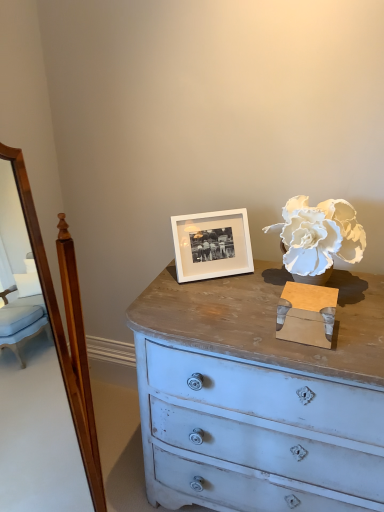
The image size is (384, 512). What do you see at coordinates (318, 237) in the screenshot?
I see `white paper flower at upper right` at bounding box center [318, 237].

This screenshot has width=384, height=512. In order to click on white paper flower at upper right in this screenshot , I will do `click(318, 237)`.

The width and height of the screenshot is (384, 512). What do you see at coordinates (212, 245) in the screenshot?
I see `white matte picture frame at center` at bounding box center [212, 245].

This screenshot has width=384, height=512. I want to click on white matte picture frame at center, so click(x=212, y=245).

Identify the location of white paper flower at upper right. (318, 237).

In the scene shown: Is white matte picture frame at center to the left of white paper flower at upper right from the viewer's perspective?

Yes, white matte picture frame at center is to the left of white paper flower at upper right.

Which is in front, white matte picture frame at center or white paper flower at upper right?

white paper flower at upper right is in front.

Which is nearer, (245, 265) or (309, 244)?

Clearly, point (245, 265) is more distant from the camera than point (309, 244).

From the image's perspective, does white matte picture frame at center appear higher than white paper flower at upper right?

No.

In the scene shown: From a real-world perspective, is white matte picture frame at center positioned over white paper flower at upper right based on gravity?

No, from a real-world perspective, white matte picture frame at center is not over white paper flower at upper right

Considering the sizes of objects white matte picture frame at center and white paper flower at upper right in the image provided, who is wider, white matte picture frame at center or white paper flower at upper right?

With larger width is white paper flower at upper right.

In terms of height, does white matte picture frame at center look taller or shorter compared to white paper flower at upper right?

In the image, white matte picture frame at center appears to be shorter than white paper flower at upper right.

Is white matte picture frame at center bigger than white paper flower at upper right?

No.

Is white matte picture frame at center not inside white paper flower at upper right?

Absolutely, white matte picture frame at center is external to white paper flower at upper right.

Is white matte picture frame at center in contact with white paper flower at upper right?

No, white matte picture frame at center is not next to white paper flower at upper right.

Could you tell me if white matte picture frame at center is turned towards white paper flower at upper right?

No, white matte picture frame at center is not aimed at white paper flower at upper right.

How different are the orientations of white matte picture frame at center and white paper flower at upper right in degrees?

The angular difference between white matte picture frame at center and white paper flower at upper right is 38.6 degrees.

Measure the distance from white matte picture frame at center to white paper flower at upper right.

white matte picture frame at center is 10.79 inches from white paper flower at upper right.

Locate an element on the screen. This screenshot has width=384, height=512. flower on the right of white matte picture frame at center is located at coordinates (318, 237).

Between white paper flower at upper right and white matte picture frame at center, which one appears on the right side from the viewer's perspective?

From the viewer's perspective, white paper flower at upper right appears more on the right side.

Considering the relative positions of white paper flower at upper right and white matte picture frame at center in the image provided, is white paper flower at upper right behind white matte picture frame at center?

That is False.

Which point is more distant from viewer, (332, 259) or (207, 274)?

The point (207, 274) is more distant.

From the image's perspective, who appears lower, white paper flower at upper right or white matte picture frame at center?

A: white matte picture frame at center, from the image's perspective.

Consider the image. From a real-world perspective, does white paper flower at upper right sit lower than white matte picture frame at center?

Incorrect, from a real-world perspective, white paper flower at upper right is higher than white matte picture frame at center.

Is white paper flower at upper right wider or thinner than white matte picture frame at center?

white paper flower at upper right is wider than white matte picture frame at center.

Who is shorter, white paper flower at upper right or white matte picture frame at center?

white matte picture frame at center.

Who is smaller, white paper flower at upper right or white matte picture frame at center?

Smaller between the two is white matte picture frame at center.

Is white paper flower at upper right spatially inside white matte picture frame at center, or outside of it?

white paper flower at upper right is located beyond the bounds of white matte picture frame at center.

Are white paper flower at upper right and white matte picture frame at center located far from each other?

Actually, white paper flower at upper right and white matte picture frame at center are a little close together.

Does white paper flower at upper right turn towards white matte picture frame at center?

No, white paper flower at upper right does not turn towards white matte picture frame at center.

How many degrees apart are the facing directions of white paper flower at upper right and white matte picture frame at center?

The facing directions of white paper flower at upper right and white matte picture frame at center are 38.6 degrees apart.

How much distance is there between white paper flower at upper right and white matte picture frame at center?

white paper flower at upper right is 27.39 centimeters from white matte picture frame at center.

The height and width of the screenshot is (512, 384). I want to click on picture frame behind the white paper flower at upper right, so click(212, 245).

This screenshot has height=512, width=384. I want to click on flower above the white matte picture frame at center (from a real-world perspective), so click(318, 237).

The width and height of the screenshot is (384, 512). I want to click on flower above the white matte picture frame at center (from the image's perspective), so click(x=318, y=237).